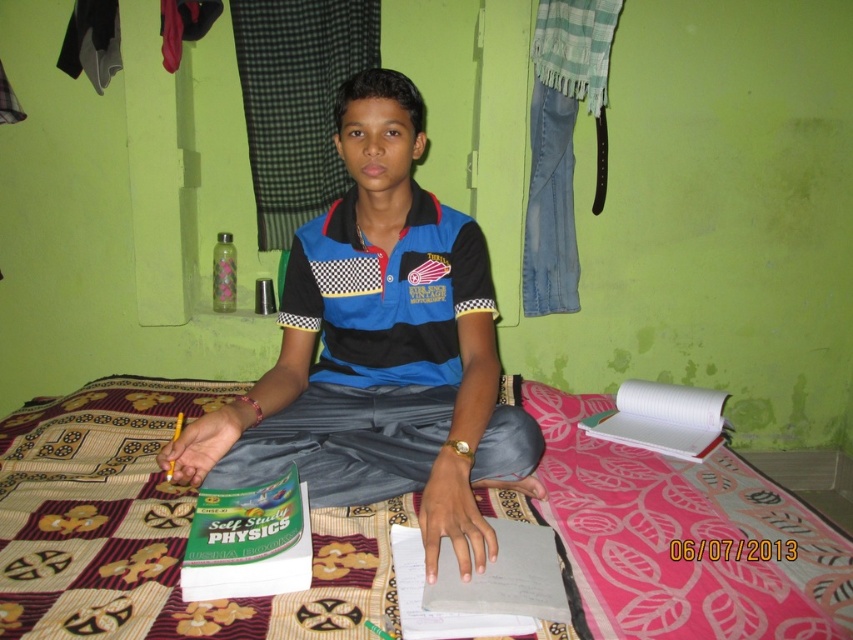
The height and width of the screenshot is (640, 853). What do you see at coordinates (154, 531) in the screenshot?
I see `patterned fabric bed at center` at bounding box center [154, 531].

Does patterned fabric bed at center have a lesser height compared to blue cotton shirt at center?

Indeed, patterned fabric bed at center has a lesser height compared to blue cotton shirt at center.

Between point (84, 474) and point (277, 406), which one is positioned behind?

The point (84, 474) is behind.

Where is `patterned fabric bed at center`? patterned fabric bed at center is located at coordinates (154, 531).

Does point (163, 506) come closer to viewer compared to point (347, 300)?

That is True.

You are a GUI agent. You are given a task and a screenshot of the screen. Output one action in this format:
    pyautogui.click(x=<x>, y=<y>)
    Task: Click on the patterned fabric bed at center
    
    Given the screenshot: What is the action you would take?
    pyautogui.click(x=154, y=531)

You are a GUI agent. You are given a task and a screenshot of the screen. Output one action in this format:
    pyautogui.click(x=<x>, y=<y>)
    Task: Click on the patterned fabric bed at center
    
    Given the screenshot: What is the action you would take?
    pyautogui.click(x=154, y=531)

Between blue cotton shirt at center and blue checkered polo shirt at center, which one is positioned lower?

blue cotton shirt at center is lower down.

Is point (389, 436) more distant than point (401, 252)?

No, it is in front of (401, 252).

This screenshot has width=853, height=640. I want to click on blue cotton shirt at center, so click(380, 349).